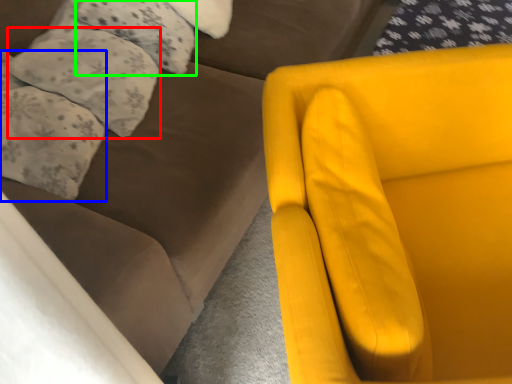
Question: Considering the real-world distances, which object is farthest from pillow (highlighted by a red box)? pillow (highlighted by a blue box) or pillow (highlighted by a green box)?

Choices:
 (A) pillow
 (B) pillow

Answer: (B)